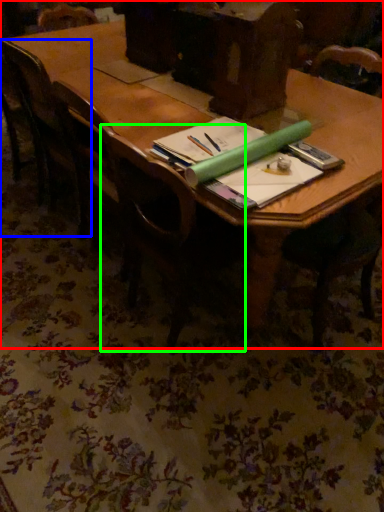
Question: Considering the real-world distances, which object is closest to table (highlighted by a red box)? chair (highlighted by a blue box) or chair (highlighted by a green box).

Choices:
 (A) chair
 (B) chair

Answer: (A)